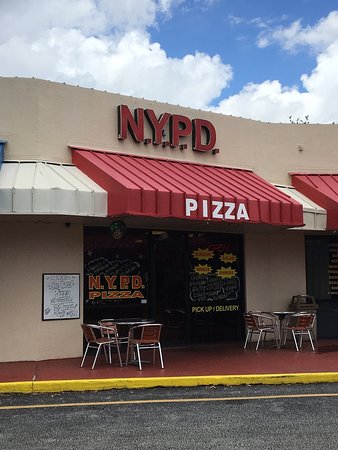
At what (x,y) coordinates should I click in order to perform the action: click on red chair. Please return your answer as a coordinate pair (x, y). The image size is (338, 450). Looking at the image, I should click on (251, 322), (306, 325), (147, 337), (111, 328), (99, 339).